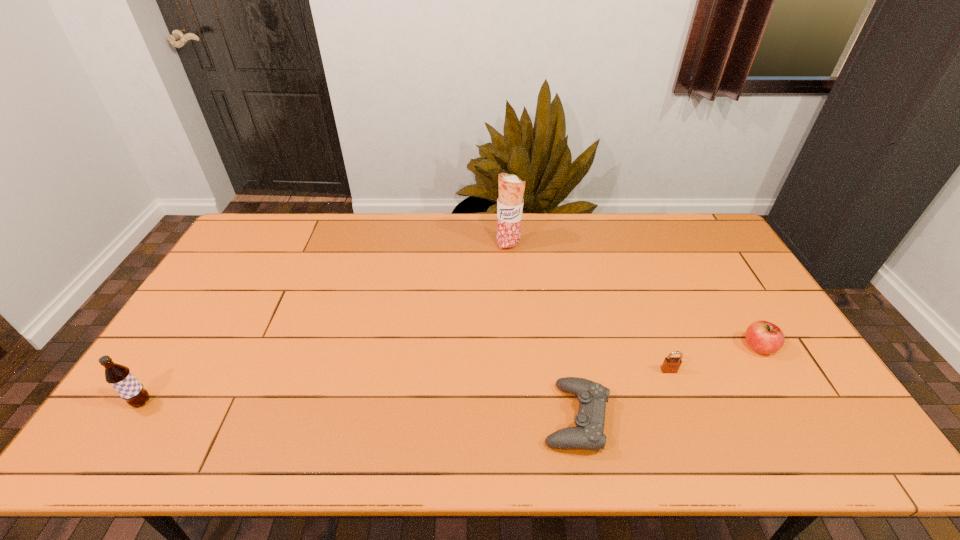
This screenshot has height=540, width=960. Identify the location of the second object from left to right. (511, 188).

Image resolution: width=960 pixels, height=540 pixels. Identify the location of the farthest object. (511, 188).

Where is `the leftmost object`? the leftmost object is located at coordinates (122, 380).

At what (x,y) coordinates should I click in order to perform the action: click on the fourth shortest object. Please return your answer as a coordinate pair (x, y). Looking at the image, I should click on (122, 380).

The height and width of the screenshot is (540, 960). In order to click on the rightmost object in this screenshot , I will do `click(764, 337)`.

Image resolution: width=960 pixels, height=540 pixels. Find the location of `apple`. apple is located at coordinates (764, 337).

In order to click on padlock in this screenshot , I will do `click(671, 364)`.

Locate an element on the screen. The width and height of the screenshot is (960, 540). the second object from right to left is located at coordinates (671, 364).

Where is `the third object from left to right`? Image resolution: width=960 pixels, height=540 pixels. the third object from left to right is located at coordinates (588, 434).

The height and width of the screenshot is (540, 960). What are the coordinates of `the shortest object` in the screenshot? It's located at (588, 434).